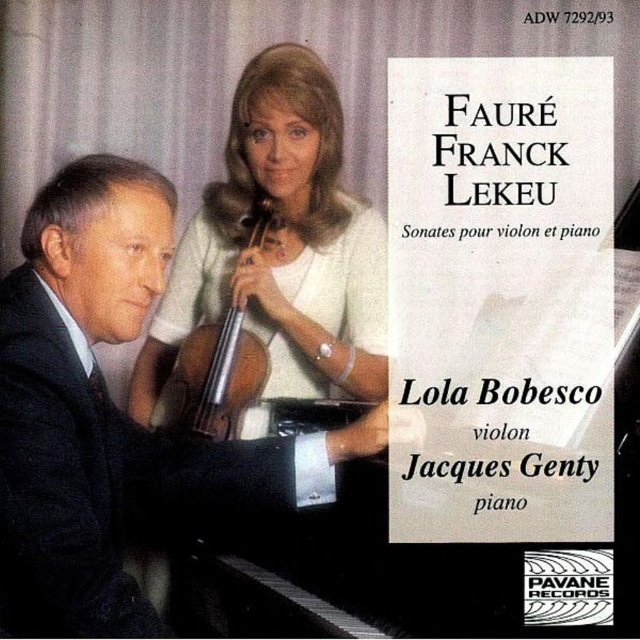
Is matte white violin at upper center in front of wooden polished cello at center?

Yes, it is in front of wooden polished cello at center.

Who is positioned more to the left, matte white violin at upper center or wooden polished cello at center?

Positioned to the left is wooden polished cello at center.

The image size is (640, 640). What do you see at coordinates (280, 246) in the screenshot?
I see `matte white violin at upper center` at bounding box center [280, 246].

Image resolution: width=640 pixels, height=640 pixels. I want to click on matte white violin at upper center, so click(280, 246).

Can you confirm if black suit at left is smaller than wooden polished cello at center?

No, black suit at left is not smaller than wooden polished cello at center.

Between black suit at left and wooden polished cello at center, which one appears on the right side from the viewer's perspective?

wooden polished cello at center is more to the right.

Locate an element on the screen. black suit at left is located at coordinates (112, 413).

Between black suit at left and matte white violin at upper center, which one is positioned higher?

Positioned higher is matte white violin at upper center.

Which is behind, point (13, 400) or point (221, 259)?

The point (221, 259) is more distant.

Locate an element on the screen. The height and width of the screenshot is (640, 640). black suit at left is located at coordinates coord(112,413).